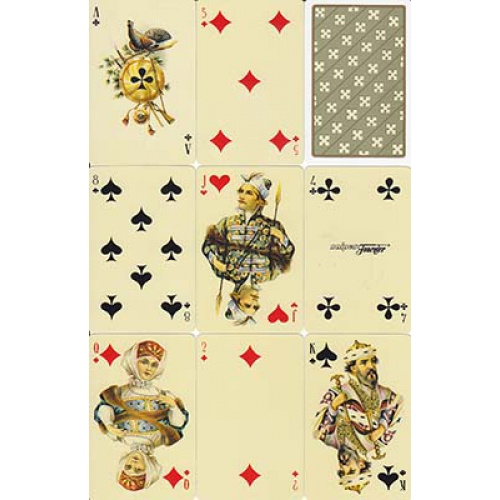
This screenshot has height=500, width=500. Identify the location of playing cards. (162, 82), (250, 68), (347, 64), (247, 221), (372, 238), (170, 229), (130, 397), (258, 407), (378, 413).